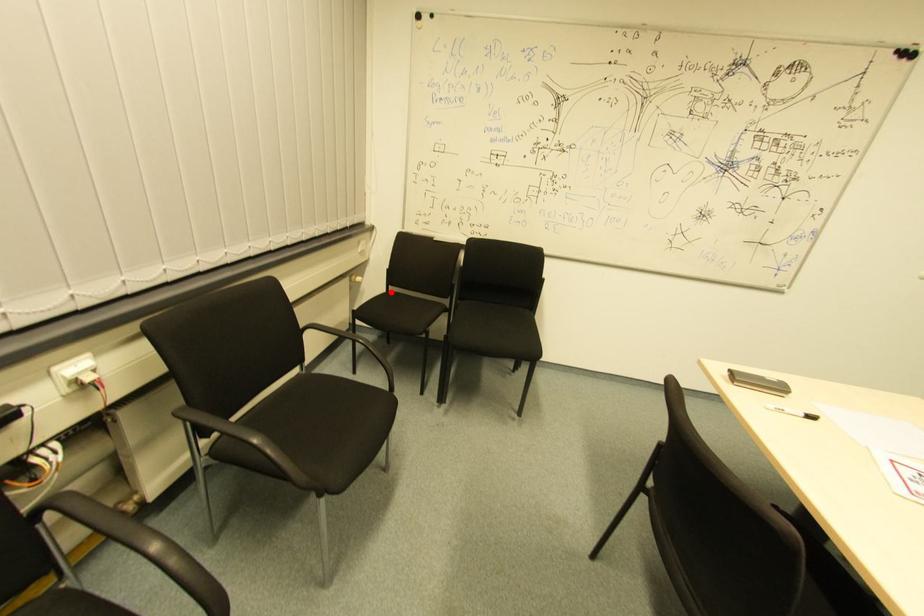
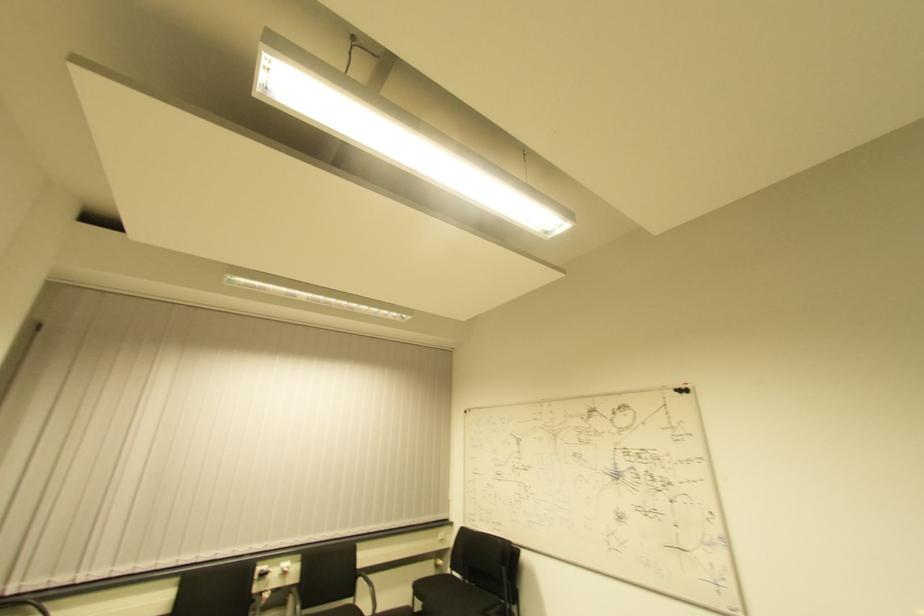
The point at the highlighted location is marked in the first image. Where is the corresponding point in the second image?

(454, 576)